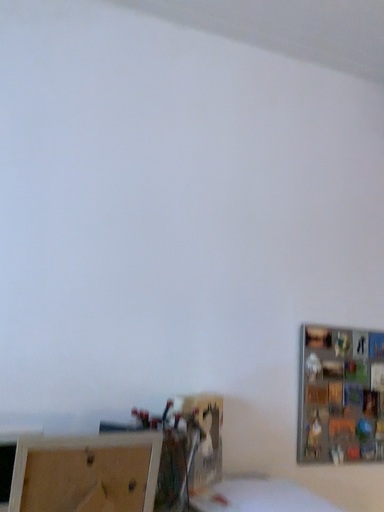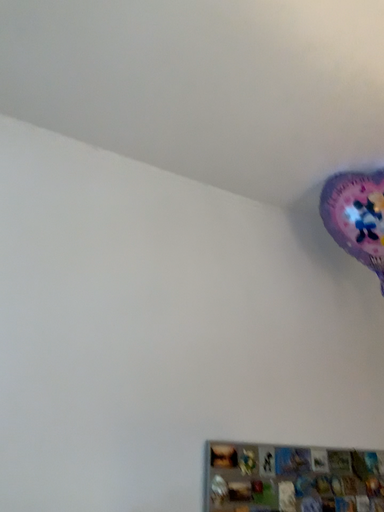
Question: How did the camera likely rotate when shooting the video?

Choices:
 (A) rotated upward
 (B) rotated downward

Answer: (A)